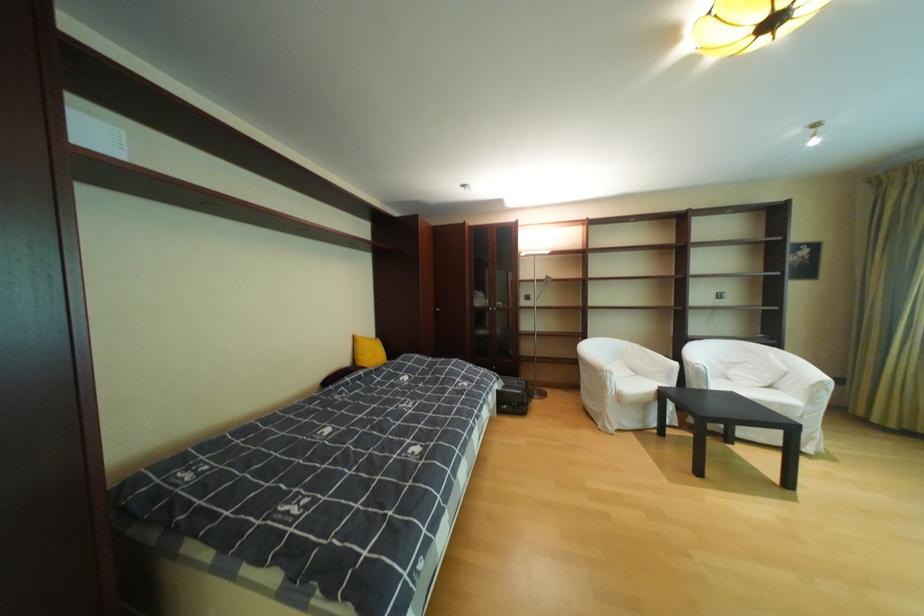
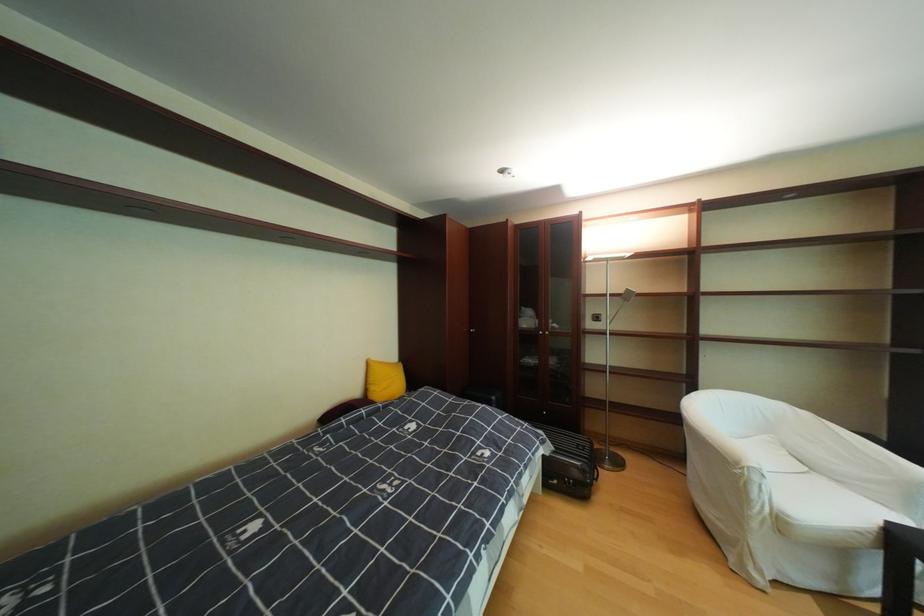
In the second image, find the point that corresponds to point (638, 345) in the first image.

(793, 407)